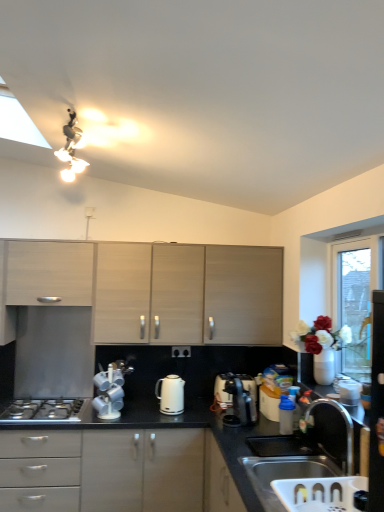
Question: Could you tell me if blue plastic container at lower right, the second appliance when ordered from right to left, is turned towards matte wood cabinets at center, the second cabinetry when ordered from left to right?

Choices:
 (A) no
 (B) yes

Answer: (A)

Question: Is blue plastic container at lower right, the 2th appliance in the back-to-front sequence, facing away from matte wood cabinets at center, which ranks as the 1th cabinetry in right-to-left order?

Choices:
 (A) yes
 (B) no

Answer: (B)

Question: Can you confirm if blue plastic container at lower right, the second appliance when ordered from right to left, is positioned to the left of matte wood cabinets at center, the second cabinetry when ordered from left to right?

Choices:
 (A) yes
 (B) no

Answer: (B)

Question: Is blue plastic container at lower right, the 2th appliance in the back-to-front sequence, bigger than matte wood cabinets at center, the second cabinetry when ordered from left to right?

Choices:
 (A) no
 (B) yes

Answer: (A)

Question: From a real-world perspective, is blue plastic container at lower right, the second appliance when ordered from right to left, beneath matte wood cabinets at center, which ranks as the 1th cabinetry in right-to-left order?

Choices:
 (A) no
 (B) yes

Answer: (B)

Question: Considering the positions of matte wood cabinets at center, which ranks as the 1th cabinetry in right-to-left order, and blue plastic container at lower right, the second appliance when ordered from right to left, in the image, is matte wood cabinets at center, which ranks as the 1th cabinetry in right-to-left order, bigger or smaller than blue plastic container at lower right, the second appliance when ordered from right to left,?

Choices:
 (A) big
 (B) small

Answer: (A)

Question: Considering the relative positions of matte wood cabinets at center, which ranks as the 1th cabinetry in right-to-left order, and blue plastic container at lower right, which appears as the 2th appliance when viewed from the left, in the image provided, is matte wood cabinets at center, which ranks as the 1th cabinetry in right-to-left order, to the left or to the right of blue plastic container at lower right, which appears as the 2th appliance when viewed from the left,?

Choices:
 (A) right
 (B) left

Answer: (B)

Question: Relative to blue plastic container at lower right, the second appliance when ordered from right to left, is matte wood cabinets at center, the second cabinetry when ordered from left to right, in front or behind?

Choices:
 (A) front
 (B) behind

Answer: (B)

Question: In terms of width, does matte wood cabinets at center, the second cabinetry when ordered from left to right, look wider or thinner when compared to blue plastic container at lower right, the second appliance when ordered from right to left?

Choices:
 (A) wide
 (B) thin

Answer: (A)

Question: Is point (289, 424) closer or farther from the camera than point (13, 262)?

Choices:
 (A) closer
 (B) farther

Answer: (A)

Question: From the image's perspective, is blue plastic container at lower right, the second appliance when ordered from right to left, above or below matte wood cabinet at left, which appears as the 2th cabinetry when viewed from the right?

Choices:
 (A) above
 (B) below

Answer: (B)

Question: Considering the positions of blue plastic container at lower right, the second appliance when ordered from right to left, and matte wood cabinet at left, placed as the 1th cabinetry when sorted from left to right, in the image, is blue plastic container at lower right, the second appliance when ordered from right to left, wider or thinner than matte wood cabinet at left, placed as the 1th cabinetry when sorted from left to right,?

Choices:
 (A) thin
 (B) wide

Answer: (A)

Question: From a real-world perspective, is blue plastic container at lower right, the second appliance when ordered from right to left, physically located above or below matte wood cabinet at left, placed as the 1th cabinetry when sorted from left to right?

Choices:
 (A) above
 (B) below

Answer: (B)

Question: Do you think silver metallic sink at lower right is within matte wood cabinets at center, which ranks as the 1th cabinetry in right-to-left order, or outside of it?

Choices:
 (A) outside
 (B) inside

Answer: (A)

Question: From the image's perspective, is silver metallic sink at lower right positioned above or below matte wood cabinets at center, which ranks as the 1th cabinetry in right-to-left order?

Choices:
 (A) below
 (B) above

Answer: (A)